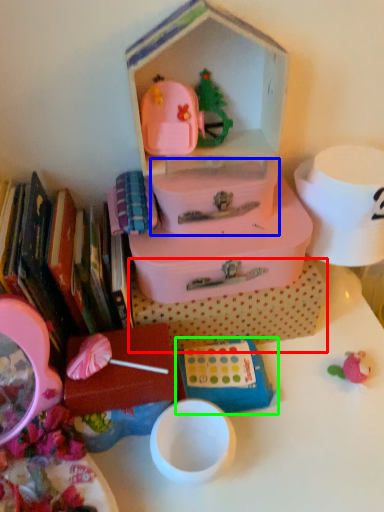
Question: Which is nearer to the storage box (highlighted by a red box)? storage box (highlighted by a blue box) or toy (highlighted by a green box).

Choices:
 (A) storage box
 (B) toy

Answer: (B)